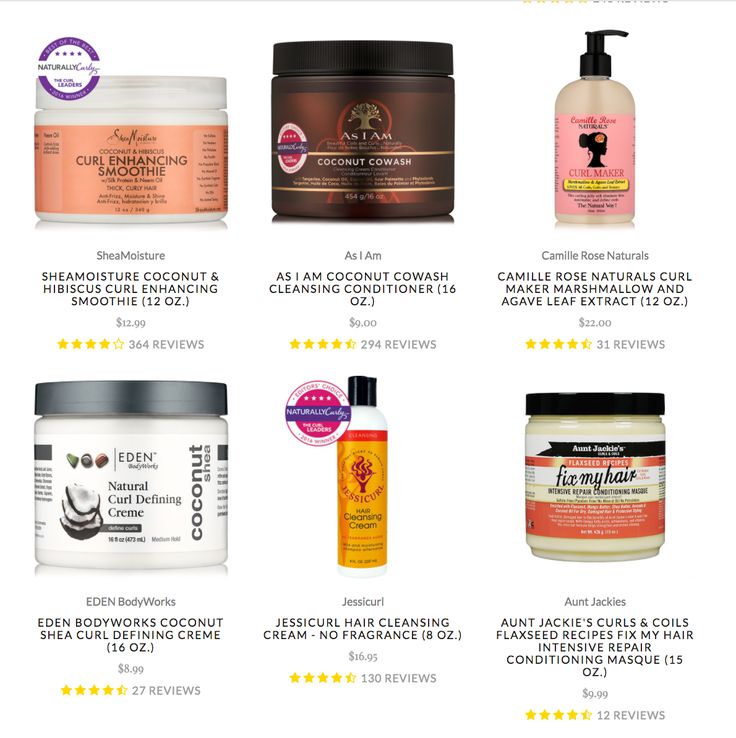
The image size is (736, 738). What are the coordinates of `containers with black lids` in the screenshot? It's located at (363, 117), (628, 125), (633, 432), (366, 489).